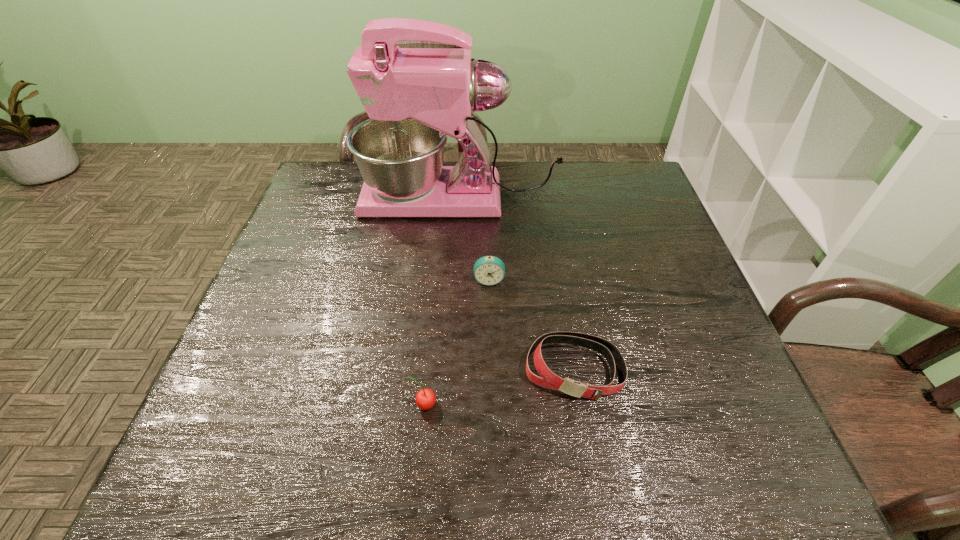
Identify the location of vacant space located 0.220m on the right of the shortest object. The image size is (960, 540). (730, 369).

Identify the location of object present at the far edge. click(x=415, y=98).

The height and width of the screenshot is (540, 960). Identify the location of vacant space at the far edge of the desktop. (575, 174).

In the image, there is a desktop. At what (x,y) coordinates should I click in order to perform the action: click on vacant area at the near edge. Please return your answer as a coordinate pair (x, y). Looking at the image, I should click on pos(398,452).

The width and height of the screenshot is (960, 540). I want to click on vacant space at the left edge of the desktop, so click(294, 381).

In the image, there is a desktop. Identify the location of vacant space at the right edge. The width and height of the screenshot is (960, 540). click(x=670, y=344).

Find the location of a particular element. This screenshot has width=960, height=540. vacant area at the far left corner of the desktop is located at coordinates (362, 181).

At what (x,y) coordinates should I click in order to perform the action: click on free space at the far right corner of the desktop. Please return your answer as a coordinate pair (x, y). Looking at the image, I should click on (625, 187).

Find the location of a particular element. This screenshot has height=540, width=960. vacant point at the near right corner is located at coordinates (741, 451).

This screenshot has height=540, width=960. Find the location of `empty location between the farthest object and the alarm clock`. empty location between the farthest object and the alarm clock is located at coordinates (475, 239).